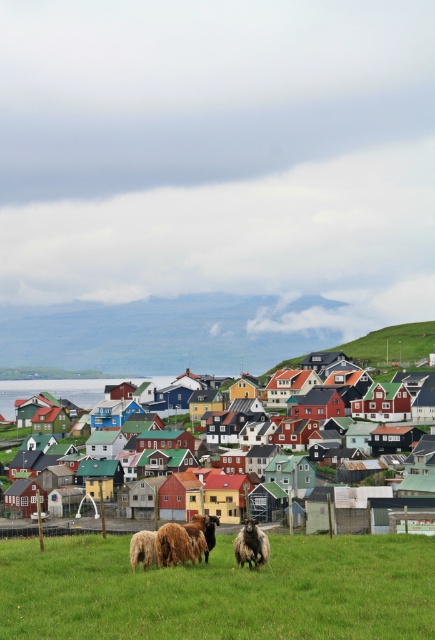
You are a shepherd observing the dark woolen sheep at lower center and the white woolen sheep at lower center in the grassy field. Which sheep appears taller?

The dark woolen sheep at lower center appears taller than the white woolen sheep at lower center.

You are a photographer standing in the coastal village field. You want to take a photo that includes both the dark woolen sheep at lower center and the white woolen sheep at lower center. Which sheep should you focus on first to ensure both are in the frame?

You should focus on the dark woolen sheep at lower center first because it is positioned under the white woolen sheep at lower center, so adjusting the camera angle to include both would require ensuring the lower one is framed first.